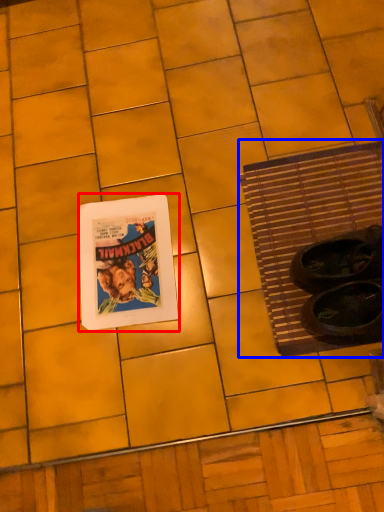
Question: Which of the following is the closest to the observer, picture frame (highlighted by a red box) or bath mat (highlighted by a blue box)?

Choices:
 (A) picture frame
 (B) bath mat

Answer: (B)